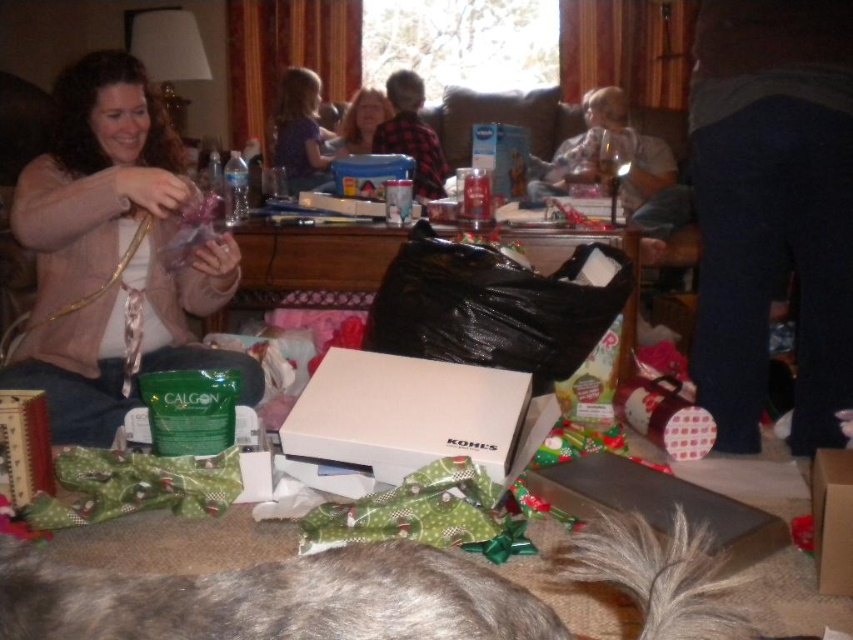
Does point (691, 541) lie in front of point (837, 465)?

Yes, it is in front of point (837, 465).

How much distance is there between gray fluffy tail at lower center and brown cardboard box at lower right?

gray fluffy tail at lower center is 35.02 centimeters away from brown cardboard box at lower right.

Is point (637, 563) positioned behind point (817, 589)?

No, (637, 563) is closer to viewer.

Find the location of a particular element. The width and height of the screenshot is (853, 640). gray fluffy tail at lower center is located at coordinates (656, 573).

Which of these two, purple dotted shirt at upper center or flannel shirt at center, stands taller?

With more height is flannel shirt at center.

Does purple dotted shirt at upper center appear under flannel shirt at center?

Indeed, purple dotted shirt at upper center is positioned under flannel shirt at center.

Is point (314, 81) positioned in front of point (396, 134)?

No.

I want to click on purple dotted shirt at upper center, so click(300, 131).

At what (x,y) coordinates should I click in order to perform the action: click on pink fabric at left. Please return your answer as a coordinate pair (x, y). This screenshot has width=853, height=640. Looking at the image, I should click on (112, 256).

Is pink fabric at left positioned before blonde hair at center?

Yes, pink fabric at left is closer to the viewer.

Is point (163, 220) positioned after point (352, 115)?

No.

The image size is (853, 640). What are the coordinates of `pink fabric at left` in the screenshot? It's located at (112, 256).